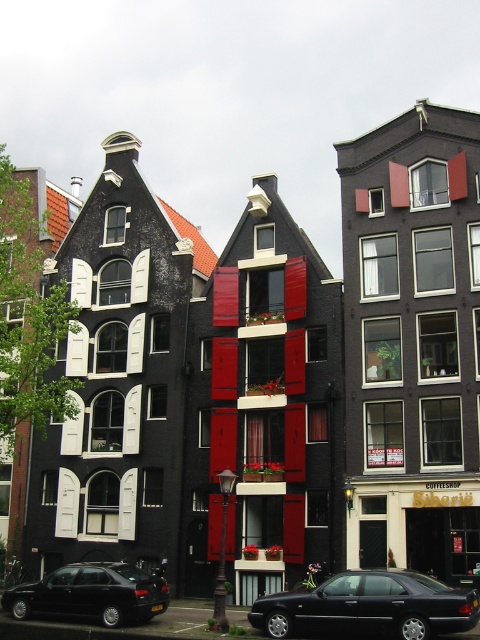
Between shiny black sedan at center and shiny black sedan at lower left, which one is positioned higher?

shiny black sedan at center is above.

Does shiny black sedan at center appear on the right side of shiny black sedan at lower left?

Correct, you'll find shiny black sedan at center to the right of shiny black sedan at lower left.

Identify the location of shiny black sedan at center. (369, 605).